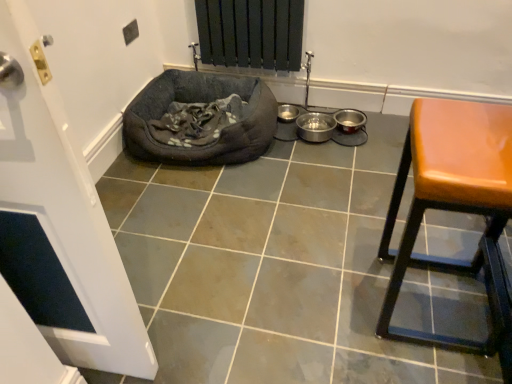
At what (x,y) coordinates should I click in order to perform the action: click on vacant space in between leatherette stool at right and dark gray fabric dog bed at lower left. Please return your answer as a coordinate pair (x, y). This screenshot has height=384, width=512. Looking at the image, I should click on (x=294, y=216).